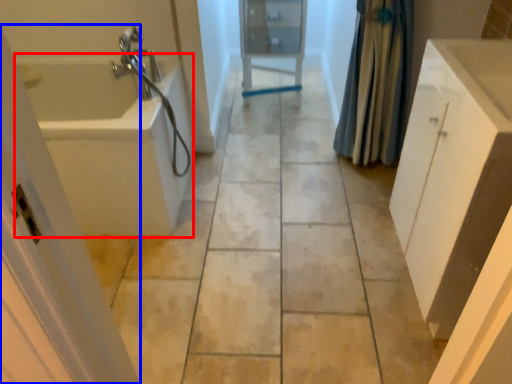
Question: Which of the following is the closest to the observer, bath (highlighted by a red box) or screen door (highlighted by a blue box)?

Choices:
 (A) bath
 (B) screen door

Answer: (B)